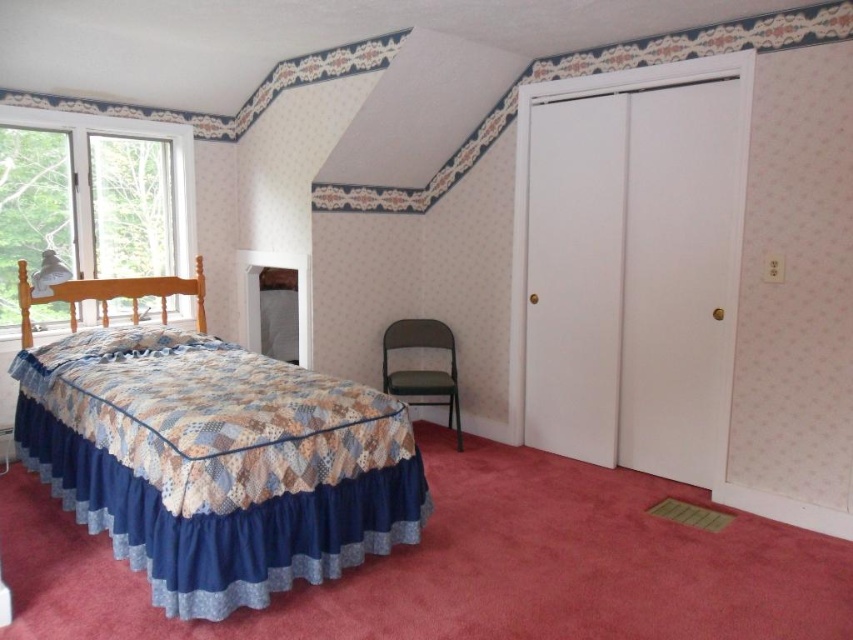
Question: Is patchwork fabric bed at left below matte green folding chair at center?

Choices:
 (A) yes
 (B) no

Answer: (A)

Question: Can you confirm if patchwork fabric bed at left is positioned below clear glass window at left?

Choices:
 (A) no
 (B) yes

Answer: (B)

Question: Is patchwork fabric bed at left positioned behind matte green folding chair at center?

Choices:
 (A) yes
 (B) no

Answer: (B)

Question: Which object is the closest to the patchwork fabric bed at left?

Choices:
 (A) clear glass window at left
 (B) matte green folding chair at center

Answer: (A)

Question: Among these objects, which one is nearest to the camera?

Choices:
 (A) clear glass window at left
 (B) matte green folding chair at center

Answer: (A)

Question: Estimate the real-world distances between objects in this image. Which object is closer to the patchwork fabric bed at left?

Choices:
 (A) clear glass window at left
 (B) matte green folding chair at center

Answer: (A)